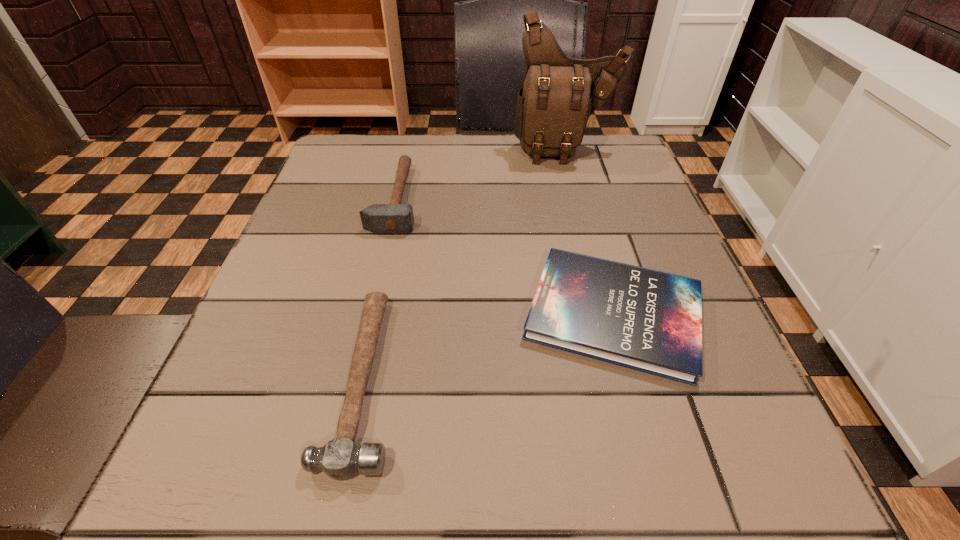
At what (x,y) coordinates should I click in order to perform the action: click on shoulder bag. Please return your answer as a coordinate pair (x, y). The height and width of the screenshot is (540, 960). Looking at the image, I should click on click(558, 95).

Locate an element on the screen. The width and height of the screenshot is (960, 540). the tallest object is located at coordinates (558, 95).

The width and height of the screenshot is (960, 540). In order to click on the second farthest object in this screenshot , I will do `click(395, 217)`.

Image resolution: width=960 pixels, height=540 pixels. Identify the location of the taller hammer. coord(395,217).

Where is `the shorter hammer`? the shorter hammer is located at coordinates (x=340, y=458).

Where is `the nearer hammer`? The width and height of the screenshot is (960, 540). the nearer hammer is located at coordinates coord(340,458).

At what (x,y) coordinates should I click in order to perform the action: click on hardback book. Please return your answer as a coordinate pair (x, y). This screenshot has height=540, width=960. Looking at the image, I should click on (643, 319).

The height and width of the screenshot is (540, 960). Identify the location of vacant region located on the front-facing side of the farthest object. click(579, 198).

Locate an element on the screen. Image resolution: width=960 pixels, height=540 pixels. vacant space located 0.150m on the striking surface of the third nearest object is located at coordinates (489, 198).

The height and width of the screenshot is (540, 960). In order to click on free space located on the striking face of the third tallest object in this screenshot , I will do `click(524, 378)`.